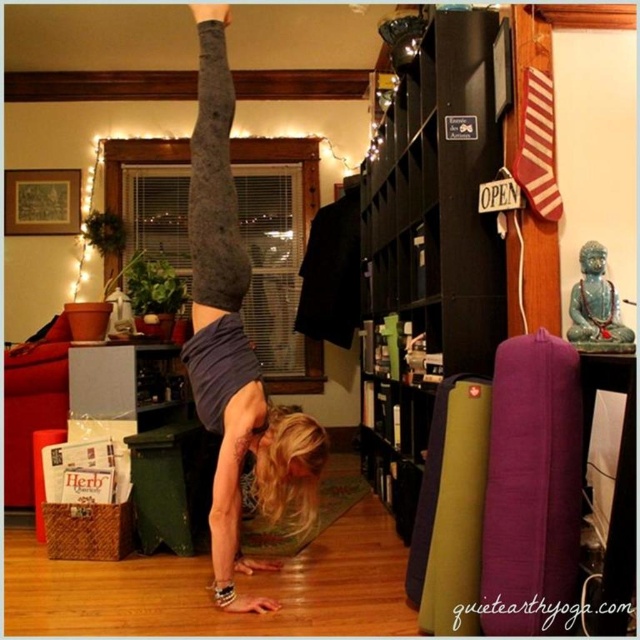
Question: Which point appears farthest from the camera in this image?

Choices:
 (A) (312, 461)
 (B) (490, 108)

Answer: (A)

Question: Is black wood bookshelf at center positioned behind matte gray leggings at center?

Choices:
 (A) no
 (B) yes

Answer: (B)

Question: Which point is farther from the camera taking this photo?

Choices:
 (A) (369, 336)
 (B) (230, 529)

Answer: (A)

Question: Is black wood bookshelf at center below matte gray leggings at center?

Choices:
 (A) yes
 (B) no

Answer: (B)

Question: Can you confirm if black wood bookshelf at center is thinner than matte gray leggings at center?

Choices:
 (A) no
 (B) yes

Answer: (B)